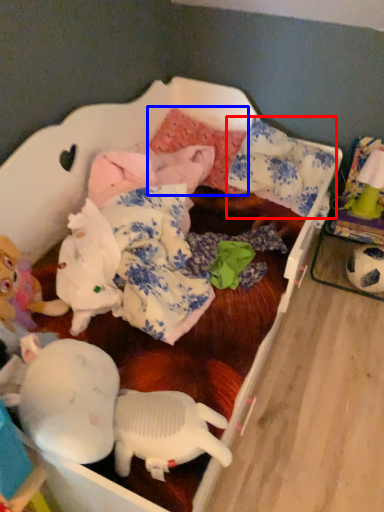
Question: Which object appears farthest to the camera in this image, pillow (highlighted by a red box) or pillow (highlighted by a blue box)?

Choices:
 (A) pillow
 (B) pillow

Answer: (B)